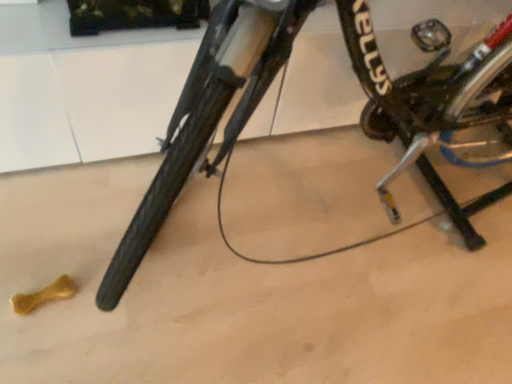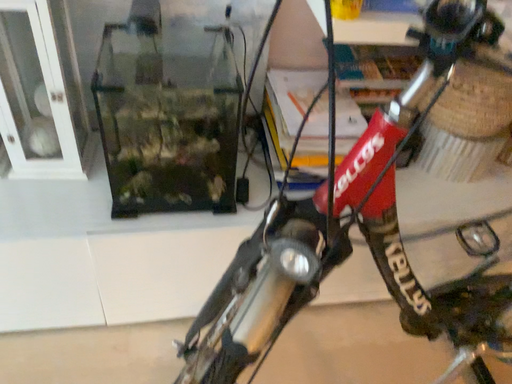
Question: How did the camera likely rotate when shooting the video?

Choices:
 (A) rotated downward
 (B) rotated upward

Answer: (B)